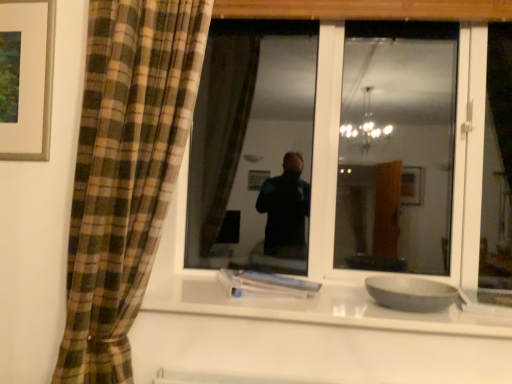
At what (x,y) coordinates should I click in order to perform the action: click on white glossy window sill at lower center. Please return your answer as a coordinate pair (x, y). Image resolution: width=512 pixels, height=384 pixels. Looking at the image, I should click on (310, 307).

In the scene shown: Measure the distance between white glossy window sill at lower center and camera.

A distance of 4.09 feet exists between white glossy window sill at lower center and camera.

Image resolution: width=512 pixels, height=384 pixels. What do you see at coordinates (310, 307) in the screenshot?
I see `white glossy window sill at lower center` at bounding box center [310, 307].

This screenshot has height=384, width=512. What are the coordinates of `white glossy window sill at lower center` in the screenshot? It's located at (310, 307).